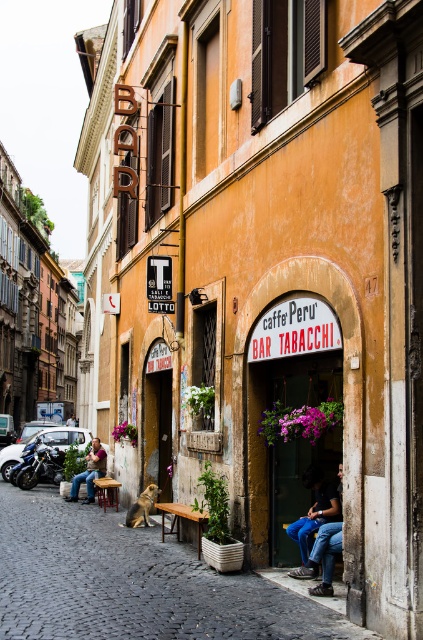
Question: Which point appears farthest from the camera in this image?

Choices:
 (A) (324, 500)
 (B) (180, 504)

Answer: (B)

Question: Is denim jeans at lower center smaller than brown wooden bench at lower center?

Choices:
 (A) no
 (B) yes

Answer: (A)

Question: Which object appears farthest from the camera in this image?

Choices:
 (A) brown wooden bench at lower center
 (B) brown wooden park bench at center
 (C) leather jacket at lower left

Answer: (C)

Question: Which point is closer to the camera taking this photo?

Choices:
 (A) (331, 499)
 (B) (167, 504)

Answer: (A)

Question: Does blue fabric bag at lower right appear over brown wooden park bench at center?

Choices:
 (A) yes
 (B) no

Answer: (A)

Question: Considering the relative positions of blue fabric bag at lower right and leather jacket at lower left in the image provided, where is blue fabric bag at lower right located with respect to leather jacket at lower left?

Choices:
 (A) below
 (B) above

Answer: (B)